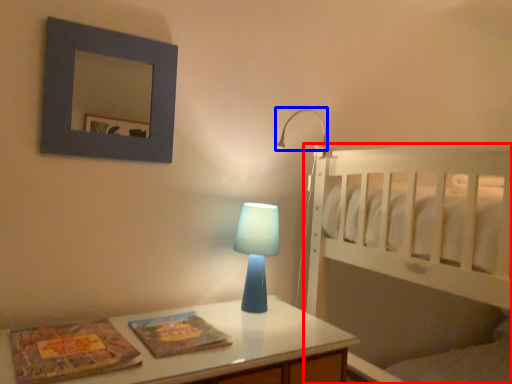
Question: Which object is further to the camera taking this photo, bed (highlighted by a red box) or lamp (highlighted by a blue box)?

Choices:
 (A) bed
 (B) lamp

Answer: (B)